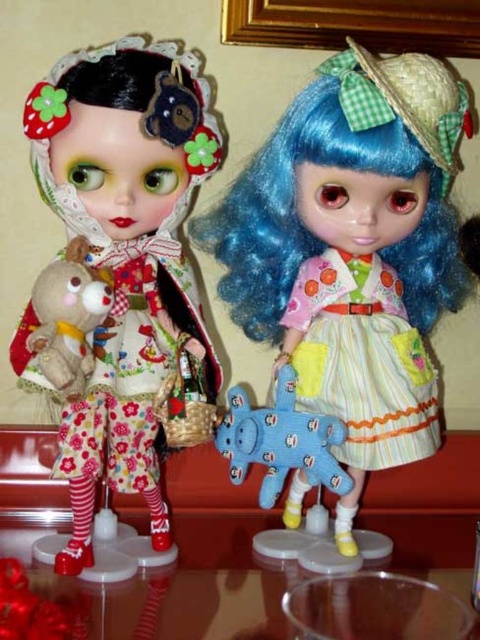
Based on the photo, between matte blue fabric doll at center and blue plush dog at center, which one has less height?

Standing shorter between the two is blue plush dog at center.

You are a GUI agent. You are given a task and a screenshot of the screen. Output one action in this format:
    pyautogui.click(x=<x>, y=<y>)
    Task: Click on the matte blue fabric doll at center
    
    Given the screenshot: What is the action you would take?
    pyautogui.click(x=352, y=250)

Who is shorter, transparent plastic table at lower center or fluffy beige teddy bear at left?

With less height is transparent plastic table at lower center.

Which is in front, point (253, 525) or point (78, 346)?

Point (78, 346) is more forward.

Identify the location of transparent plastic table at lower center. (180, 584).

Is floral fabric doll at left positioned in front of pastel striped fabric dress at right?

Yes, floral fabric doll at left is in front of pastel striped fabric dress at right.

Looking at this image, can you confirm if floral fabric doll at left is positioned below pastel striped fabric dress at right?

No, floral fabric doll at left is not below pastel striped fabric dress at right.

Between point (79, 516) and point (380, 387), which one is positioned in front?

Positioned in front is point (79, 516).

The width and height of the screenshot is (480, 640). In order to click on floral fabric doll at left in this screenshot , I will do `click(121, 260)`.